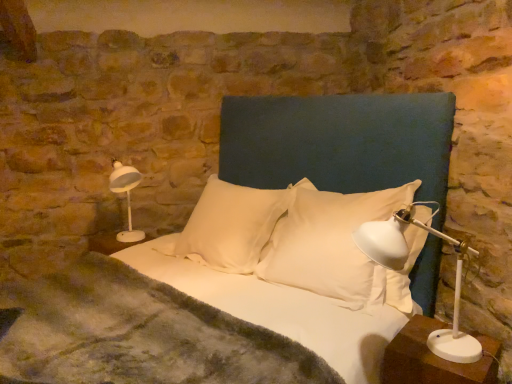
Where is `white plastic table lamp at right, arranged as the 2th table lamp when viewed from the back`? white plastic table lamp at right, arranged as the 2th table lamp when viewed from the back is located at coordinates (404, 266).

What do you see at coordinates (127, 197) in the screenshot? The width and height of the screenshot is (512, 384). I see `white glossy table lamp at left, which appears as the 1th table lamp when viewed from the back` at bounding box center [127, 197].

Identify the location of white soft pillow at center, positioned as the 2th pillow in right-to-left order. Image resolution: width=512 pixels, height=384 pixels. (230, 226).

Between white soft pillow at center, arranged as the 1th pillow when viewed from the right, and white soft pillow at center, which is the 1th pillow from left to right, which one has less height?

white soft pillow at center, which is the 1th pillow from left to right.

Is white soft pillow at center, arranged as the 1th pillow when viewed from the right, not close to white soft pillow at center, positioned as the 2th pillow in right-to-left order?

No, white soft pillow at center, arranged as the 1th pillow when viewed from the right, is not far away from white soft pillow at center, positioned as the 2th pillow in right-to-left order.

From a real-world perspective, between white soft pillow at center, arranged as the 1th pillow when viewed from the right, and white soft pillow at center, positioned as the 2th pillow in right-to-left order, who is vertically higher?

white soft pillow at center, arranged as the 1th pillow when viewed from the right.

In the scene shown: Does white soft pillow at center, marked as the second pillow in a left-to-right arrangement, have a greater width compared to white soft pillow at center, positioned as the 2th pillow in right-to-left order?

No, white soft pillow at center, marked as the second pillow in a left-to-right arrangement, is not wider than white soft pillow at center, positioned as the 2th pillow in right-to-left order.

Are white glossy table lamp at left, which appears as the 1th table lamp when viewed from the back, and white soft pillow at center, positioned as the 2th pillow in right-to-left order, far apart?

No, white glossy table lamp at left, which appears as the 1th table lamp when viewed from the back, is not far away from white soft pillow at center, positioned as the 2th pillow in right-to-left order.

Is white glossy table lamp at left, which appears as the 1th table lamp when viewed from the back, positioned beyond the bounds of white soft pillow at center, positioned as the 2th pillow in right-to-left order?

Yes, white glossy table lamp at left, which appears as the 1th table lamp when viewed from the back, is not within white soft pillow at center, positioned as the 2th pillow in right-to-left order.

Identify the location of the 1st pillow counting from the right of the white glossy table lamp at left, acting as the second table lamp starting from the front. (230, 226).

Is white fabric bed at center thinner than white plastic nightstand at lower right?

In fact, white fabric bed at center might be wider than white plastic nightstand at lower right.

Looking at this image, from the image's perspective, relative to white plastic nightstand at lower right, is white fabric bed at center above or below?

Clearly, from the image's perspective, white fabric bed at center is above white plastic nightstand at lower right.

Based on their positions, is white fabric bed at center located to the left or right of white plastic nightstand at lower right?

white fabric bed at center is to the left of white plastic nightstand at lower right.

Considering the sizes of objects white fabric bed at center and white plastic nightstand at lower right in the image provided, who is smaller, white fabric bed at center or white plastic nightstand at lower right?

white plastic nightstand at lower right is smaller.

In the scene shown: Between white plastic nightstand at lower right and dark blue fabric headboard at center, which one has less height?

Standing shorter between the two is white plastic nightstand at lower right.

Relative to dark blue fabric headboard at center, is white plastic nightstand at lower right in front or behind?

white plastic nightstand at lower right is in front of dark blue fabric headboard at center.

Could you measure the distance between white plastic nightstand at lower right and dark blue fabric headboard at center?

A distance of 34.03 inches exists between white plastic nightstand at lower right and dark blue fabric headboard at center.

From the image's perspective, is white fabric bed at center located above or below white soft pillow at center, arranged as the 1th pillow when viewed from the right?

Based on their image positions, white fabric bed at center is located beneath white soft pillow at center, arranged as the 1th pillow when viewed from the right.

Considering the sizes of objects white fabric bed at center and white soft pillow at center, arranged as the 1th pillow when viewed from the right, in the image provided, who is smaller, white fabric bed at center or white soft pillow at center, arranged as the 1th pillow when viewed from the right,?

With smaller size is white soft pillow at center, arranged as the 1th pillow when viewed from the right.

From a real-world perspective, is white fabric bed at center physically located above or below white soft pillow at center, arranged as the 1th pillow when viewed from the right?

white fabric bed at center is situated lower than white soft pillow at center, arranged as the 1th pillow when viewed from the right, in the real world.

Can you confirm if white soft pillow at center, positioned as the 2th pillow in right-to-left order, is positioned to the left of white plastic table lamp at right, arranged as the 1th table lamp when viewed from the right?

Yes.

Is white soft pillow at center, positioned as the 2th pillow in right-to-left order, next to white plastic table lamp at right, arranged as the 2th table lamp when viewed from the back?

No, white soft pillow at center, positioned as the 2th pillow in right-to-left order, is not with white plastic table lamp at right, arranged as the 2th table lamp when viewed from the back.

Between white soft pillow at center, positioned as the 2th pillow in right-to-left order, and white plastic table lamp at right, marked as the 1th table lamp in a front-to-back arrangement, which one has larger width?

white plastic table lamp at right, marked as the 1th table lamp in a front-to-back arrangement.

Is point (266, 215) closer to viewer compared to point (398, 236)?

No, (266, 215) is behind (398, 236).

Between white soft pillow at center, arranged as the 1th pillow when viewed from the right, and white plastic nightstand at lower right, which one has smaller size?

white plastic nightstand at lower right is smaller.

Considering the points (262, 250) and (420, 342), which point is in front, point (262, 250) or point (420, 342)?

The point (420, 342) is more forward.

Looking at this image, from a real-world perspective, is white soft pillow at center, arranged as the 1th pillow when viewed from the right, positioned over white plastic nightstand at lower right based on gravity?

Correct, in the physical world, white soft pillow at center, arranged as the 1th pillow when viewed from the right, is higher than white plastic nightstand at lower right.

Locate an element on the screen. This screenshot has height=384, width=512. pillow located on the right of white soft pillow at center, positioned as the 2th pillow in right-to-left order is located at coordinates (339, 246).

From a real-world perspective, count 2nd pillows downward from the white glossy table lamp at left, which appears as the second table lamp when viewed from the right, and point to it. Please provide its 2D coordinates.

[(230, 226)]

Considering their positions, is white plastic nightstand at lower right positioned closer to white plastic table lamp at right, marked as the 1th table lamp in a front-to-back arrangement, than white soft pillow at center, positioned as the 2th pillow in right-to-left order?

The object closer to white plastic table lamp at right, marked as the 1th table lamp in a front-to-back arrangement, is white plastic nightstand at lower right.

Looking at the image, which one is located further to white plastic table lamp at right, positioned as the second table lamp in left-to-right order, dark blue fabric headboard at center or white glossy table lamp at left, which appears as the 1th table lamp when viewed from the back?

Based on the image, white glossy table lamp at left, which appears as the 1th table lamp when viewed from the back, appears to be further to white plastic table lamp at right, positioned as the second table lamp in left-to-right order.

Which object lies nearer to the anchor point dark blue fabric headboard at center, white fabric bed at center or white soft pillow at center, marked as the second pillow in a left-to-right arrangement?

white fabric bed at center is positioned closer to the anchor dark blue fabric headboard at center.

Looking at the image, which one is located further to dark blue fabric headboard at center, white plastic nightstand at lower right or white soft pillow at center, arranged as the 1th pillow when viewed from the right?

Based on the image, white plastic nightstand at lower right appears to be further to dark blue fabric headboard at center.

Looking at the image, which one is located further to dark blue fabric headboard at center, white plastic table lamp at right, positioned as the second table lamp in left-to-right order, or white fabric bed at center?

Among the two, white plastic table lamp at right, positioned as the second table lamp in left-to-right order, is located further to dark blue fabric headboard at center.

Considering their positions, is white glossy table lamp at left, acting as the second table lamp starting from the front, positioned closer to white fabric bed at center than white soft pillow at center, which is the 1th pillow from left to right?

white soft pillow at center, which is the 1th pillow from left to right.

Considering their positions, is dark blue fabric headboard at center positioned closer to white glossy table lamp at left, which appears as the 1th table lamp when viewed from the back, than white soft pillow at center, marked as the second pillow in a left-to-right arrangement?

dark blue fabric headboard at center is closer to white glossy table lamp at left, which appears as the 1th table lamp when viewed from the back.

Estimate the real-world distances between objects in this image. Which object is closer to white plastic nightstand at lower right, dark blue fabric headboard at center or white soft pillow at center, which is the 1th pillow from left to right?

dark blue fabric headboard at center is closer to white plastic nightstand at lower right.

I want to click on nightstand between white plastic table lamp at right, marked as the 1th table lamp in a front-to-back arrangement, and white soft pillow at center, which is the 1th pillow from left to right, from front to back, so click(435, 358).

Find the location of a particular element. This screenshot has width=512, height=384. headboard located between white fabric bed at center and white soft pillow at center, arranged as the 1th pillow when viewed from the right, in the depth direction is located at coordinates (339, 142).

Find the location of a particular element. table lamp between white fabric bed at center and white plastic nightstand at lower right is located at coordinates (404, 266).

The width and height of the screenshot is (512, 384). Identify the location of pillow between white fabric bed at center and white soft pillow at center, positioned as the 2th pillow in right-to-left order, along the z-axis. (339, 246).